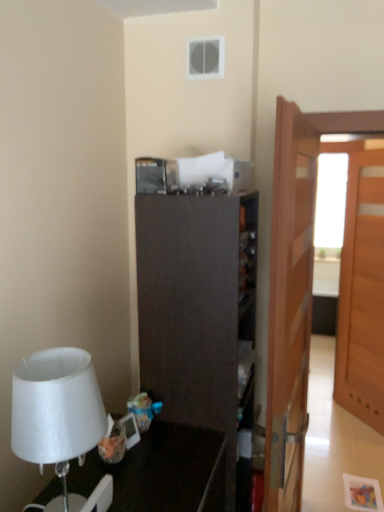
Question: Looking at their shapes, would you say wooden door at right, the first door viewed from the left, is wider or thinner than dark wood cabinet at center?

Choices:
 (A) wide
 (B) thin

Answer: (B)

Question: From the image's perspective, relative to dark wood cabinet at center, is wooden door at right, the first door viewed from the left, above or below?

Choices:
 (A) below
 (B) above

Answer: (B)

Question: Which of these objects is positioned closest to the light brown wooden door at right, which is counted as the first door, starting from the back?

Choices:
 (A) wooden door at right, the 2th door from the back
 (B) dark wood cabinet at center
 (C) white matte lampshade at left

Answer: (A)

Question: Based on their relative distances, which object is nearer to the white matte lampshade at left?

Choices:
 (A) dark wood cabinet at center
 (B) light brown wooden door at right, arranged as the 1th door when viewed from the right
 (C) wooden door at right, placed as the 1th door when sorted from front to back

Answer: (A)